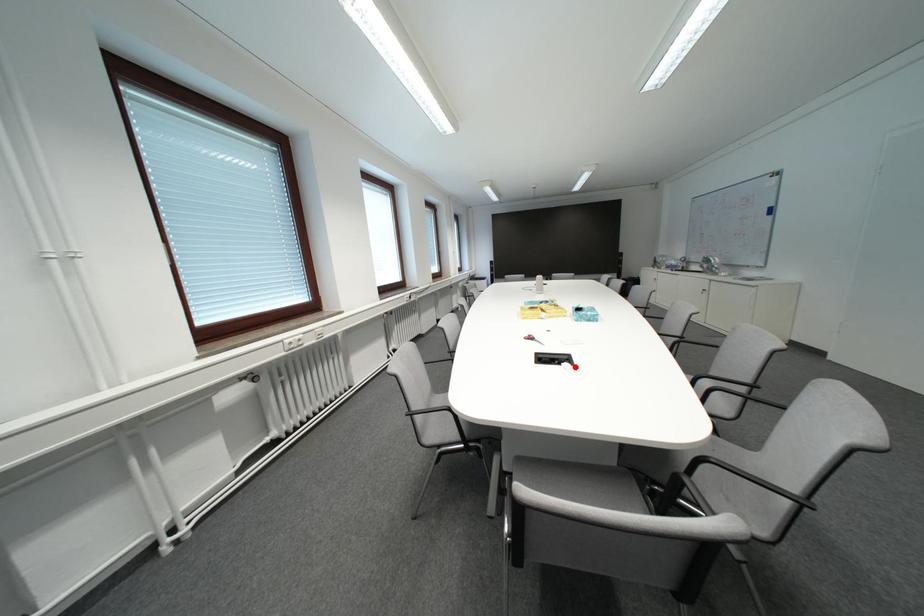
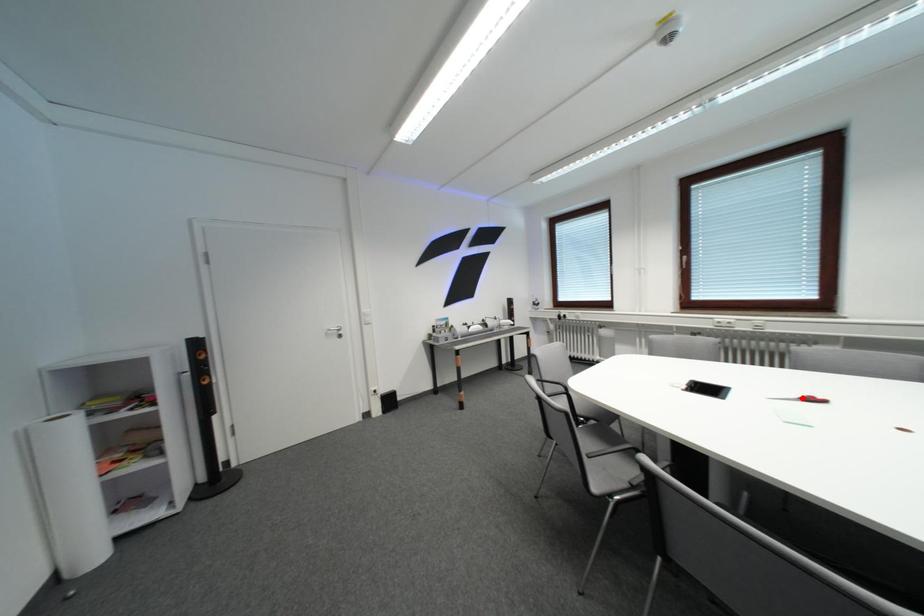
I am providing you with two images of the same scene from different viewpoints. A red point is marked on the first image and another point is marked on the second image. Are the points marked in image1 and image2 representing the same 3D position?

No